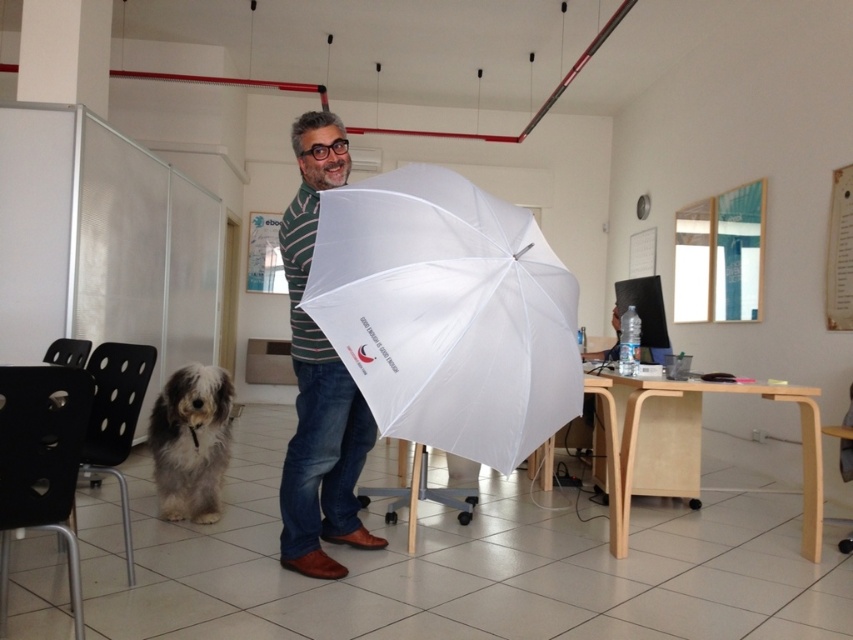
Question: Can you confirm if white matte umbrella at center is positioned below fuzzy gray dog at lower left?

Choices:
 (A) yes
 (B) no

Answer: (B)

Question: Is striped cotton shirt at center further to camera compared to fuzzy gray dog at lower left?

Choices:
 (A) no
 (B) yes

Answer: (A)

Question: Estimate the real-world distances between objects in this image. Which object is closer to the white matte umbrella at center?

Choices:
 (A) striped cotton shirt at center
 (B) fuzzy gray dog at lower left

Answer: (A)

Question: Estimate the real-world distances between objects in this image. Which object is farther from the striped cotton shirt at center?

Choices:
 (A) fuzzy gray dog at lower left
 (B) white matte umbrella at center

Answer: (B)

Question: Can you confirm if white matte umbrella at center is positioned below fuzzy gray dog at lower left?

Choices:
 (A) no
 (B) yes

Answer: (A)

Question: Which point is farther from the camera taking this photo?

Choices:
 (A) (553, 292)
 (B) (180, 492)

Answer: (B)